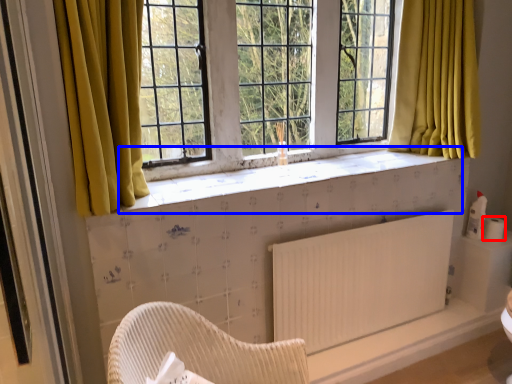
Question: Which object is further to the camera taking this photo, toilet paper (highlighted by a red box) or window sill (highlighted by a blue box)?

Choices:
 (A) toilet paper
 (B) window sill

Answer: (A)